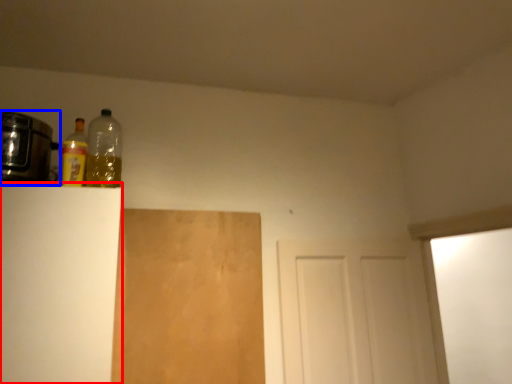
Question: Which of the following is the closest to the observer, cabinetry (highlighted by a red box) or appliance (highlighted by a blue box)?

Choices:
 (A) cabinetry
 (B) appliance

Answer: (A)